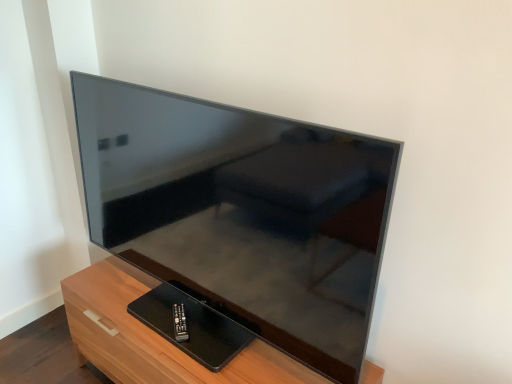
Find the location of a particular element. empty space that is ontop of wooden tv stand at lower left (from a real-world perspective) is located at coordinates (179, 326).